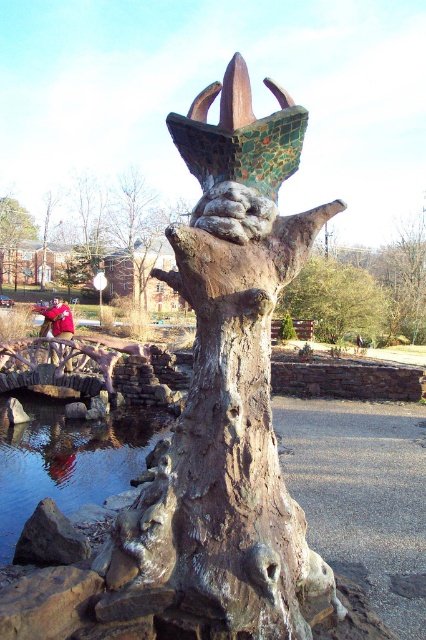
Who is taller, rustic wood tree trunk at center or matte red head at center?

rustic wood tree trunk at center

Who is shorter, rustic wood tree trunk at center or matte red head at center?

Standing shorter between the two is matte red head at center.

Between point (296, 300) and point (58, 305), which one is positioned behind?

Point (296, 300)

Where is `rustic wood tree trunk at center`? rustic wood tree trunk at center is located at coordinates (365, 291).

Which is below, rusty metal sculpture at center or clear water at lower left?

clear water at lower left is below.

Is the position of rusty metal sculpture at center more distant than that of clear water at lower left?

No.

Is point (270, 628) positioned before point (58, 426)?

Yes, it is.

The width and height of the screenshot is (426, 640). In order to click on rusty metal sculpture at center in this screenshot , I will do `click(226, 400)`.

Does green mosaic tree at upper center have a lesser width compared to matte red head at center?

No, green mosaic tree at upper center is not thinner than matte red head at center.

Which is behind, point (328, 316) or point (54, 305)?

The point (328, 316) is more distant.

Image resolution: width=426 pixels, height=640 pixels. Describe the element at coordinates (336, 300) in the screenshot. I see `green mosaic tree at upper center` at that location.

Identify the location of green mosaic tree at upper center. This screenshot has height=640, width=426. (336, 300).